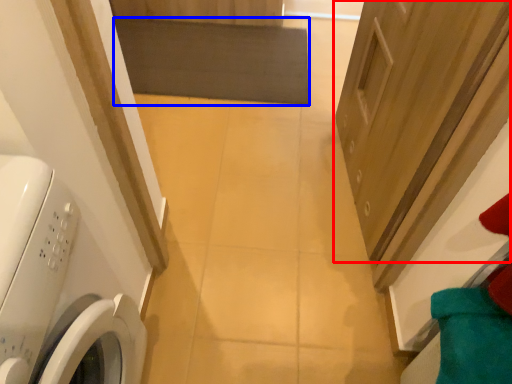
Question: Which object is further to the camera taking this photo, door (highlighted by a red box) or mat (highlighted by a blue box)?

Choices:
 (A) door
 (B) mat

Answer: (B)